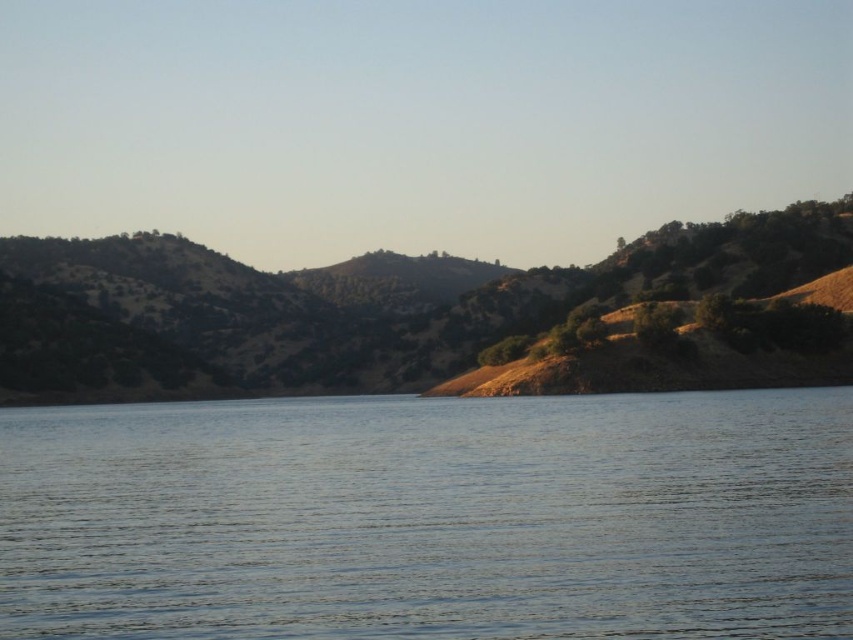
Question: Which point is farther to the camera?

Choices:
 (A) click(x=263, y=612)
 (B) click(x=368, y=285)

Answer: (B)

Question: Can you confirm if clear water at center is positioned to the right of brown/dry soil at left?

Choices:
 (A) yes
 (B) no

Answer: (A)

Question: Does clear water at center come behind brown/dry soil at left?

Choices:
 (A) no
 (B) yes

Answer: (A)

Question: Is clear water at center smaller than brown/dry soil at left?

Choices:
 (A) yes
 (B) no

Answer: (A)

Question: Which point is farther to the camera?

Choices:
 (A) brown/dry soil at left
 (B) clear water at center

Answer: (A)